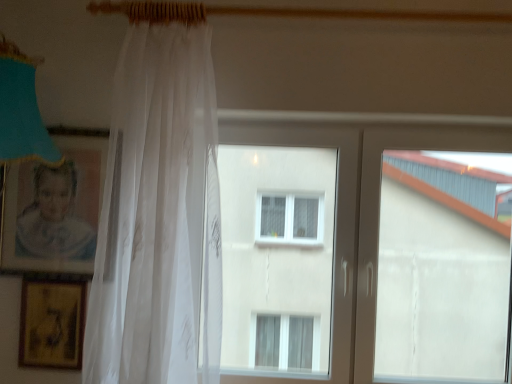
Question: Is gold textured picture frame at lower left, the second picture frame from the top, at the right side of matte cardboard picture frame at left, the 2th picture frame in the bottom-to-top sequence?

Choices:
 (A) no
 (B) yes

Answer: (B)

Question: Would you say gold textured picture frame at lower left, which is counted as the 1th picture frame, starting from the bottom, is a long distance from matte cardboard picture frame at left, placed as the 1th picture frame when sorted from top to bottom?

Choices:
 (A) yes
 (B) no

Answer: (B)

Question: Can you confirm if gold textured picture frame at lower left, the second picture frame from the top, is bigger than matte cardboard picture frame at left, placed as the 1th picture frame when sorted from top to bottom?

Choices:
 (A) no
 (B) yes

Answer: (A)

Question: Does gold textured picture frame at lower left, the second picture frame from the top, have a smaller size compared to matte cardboard picture frame at left, the 2th picture frame in the bottom-to-top sequence?

Choices:
 (A) no
 (B) yes

Answer: (B)

Question: Is gold textured picture frame at lower left, the second picture frame from the top, shorter than matte cardboard picture frame at left, the 2th picture frame in the bottom-to-top sequence?

Choices:
 (A) yes
 (B) no

Answer: (A)

Question: From the image's perspective, is gold textured picture frame at lower left, which is counted as the 1th picture frame, starting from the bottom, on top of matte cardboard picture frame at left, placed as the 1th picture frame when sorted from top to bottom?

Choices:
 (A) no
 (B) yes

Answer: (A)

Question: Can you confirm if gold textured picture frame at lower left, the second picture frame from the top, is wider than white plastic window at center?

Choices:
 (A) yes
 (B) no

Answer: (B)

Question: Is gold textured picture frame at lower left, the second picture frame from the top, next to white plastic window at center and touching it?

Choices:
 (A) yes
 (B) no

Answer: (B)

Question: Does gold textured picture frame at lower left, the second picture frame from the top, have a greater height compared to white plastic window at center?

Choices:
 (A) yes
 (B) no

Answer: (B)

Question: Is white plastic window at center surrounded by gold textured picture frame at lower left, which is counted as the 1th picture frame, starting from the bottom?

Choices:
 (A) yes
 (B) no

Answer: (B)

Question: Can you confirm if gold textured picture frame at lower left, the second picture frame from the top, is positioned to the left of white plastic window at center?

Choices:
 (A) yes
 (B) no

Answer: (A)

Question: Does gold textured picture frame at lower left, the second picture frame from the top, have a larger size compared to white plastic window at center?

Choices:
 (A) no
 (B) yes

Answer: (A)

Question: Is matte cardboard picture frame at left, placed as the 1th picture frame when sorted from top to bottom, at the left side of translucent white curtain at left?

Choices:
 (A) yes
 (B) no

Answer: (A)